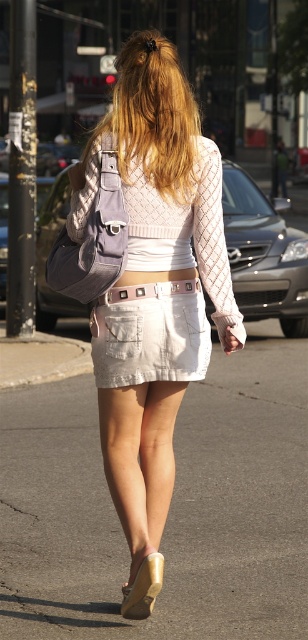
Question: Is denim shorts at center wider than white leather belt at center?

Choices:
 (A) no
 (B) yes

Answer: (B)

Question: Does light gray asphalt at center appear on the left side of blonde hair at upper center?

Choices:
 (A) yes
 (B) no

Answer: (B)

Question: Which object is the farthest from the tan leather sandal at lower center?

Choices:
 (A) blonde hair at upper center
 (B) white leather belt at center

Answer: (A)

Question: Which point appears farthest from the camera in this image?

Choices:
 (A) (141, 500)
 (B) (129, 381)
 (C) (109, 298)
 (D) (145, 58)

Answer: (D)

Question: Is tan leather sandal at lower center thinner than white leather belt at center?

Choices:
 (A) no
 (B) yes

Answer: (B)

Question: Estimate the real-world distances between objects in this image. Which object is farther from the light gray asphalt at center?

Choices:
 (A) white leather belt at center
 (B) denim shorts at center

Answer: (A)